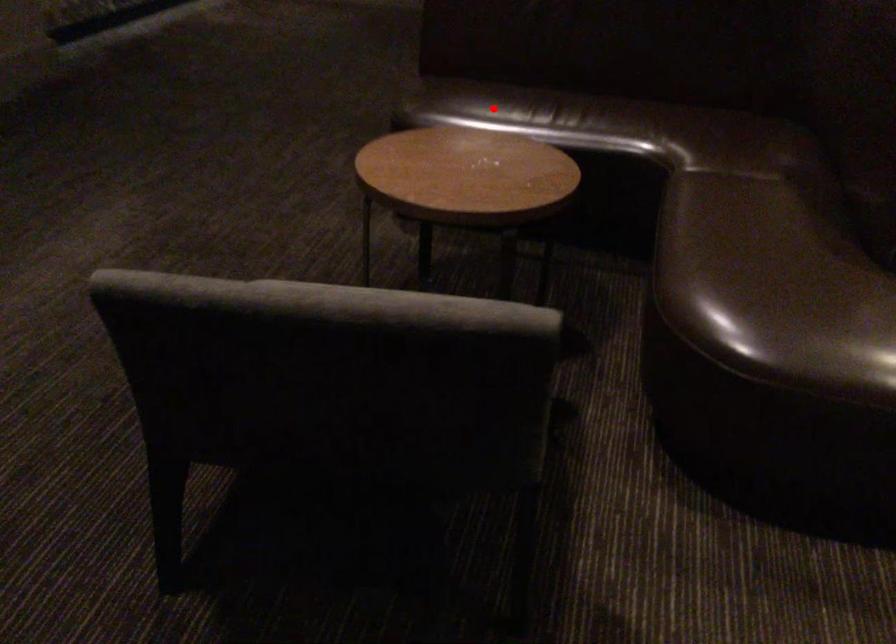
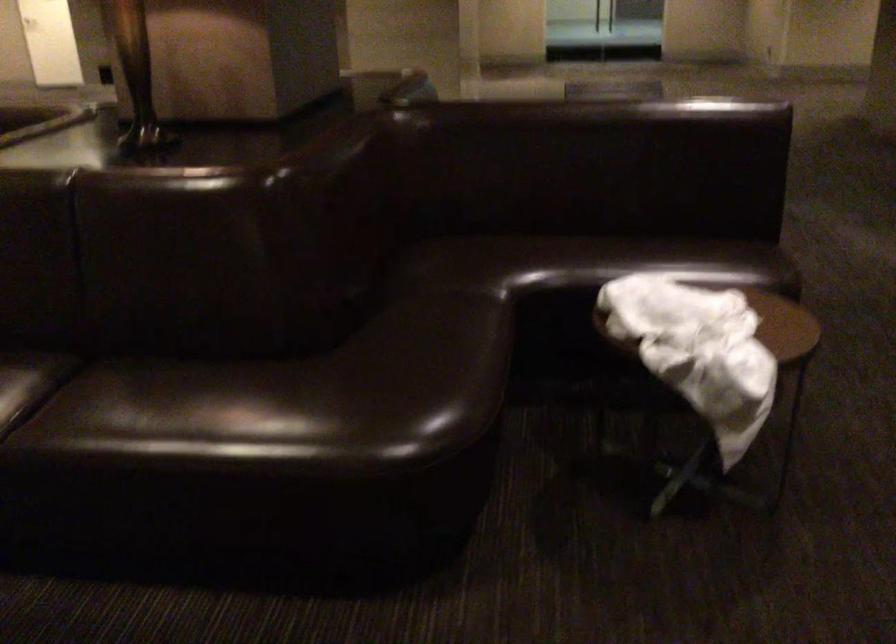
Question: I am providing you with two images of the same scene from different viewpoints. A red point is marked on the first image. Can you still see the location of the red point in image 2?

Choices:
 (A) Yes
 (B) No

Answer: (B)